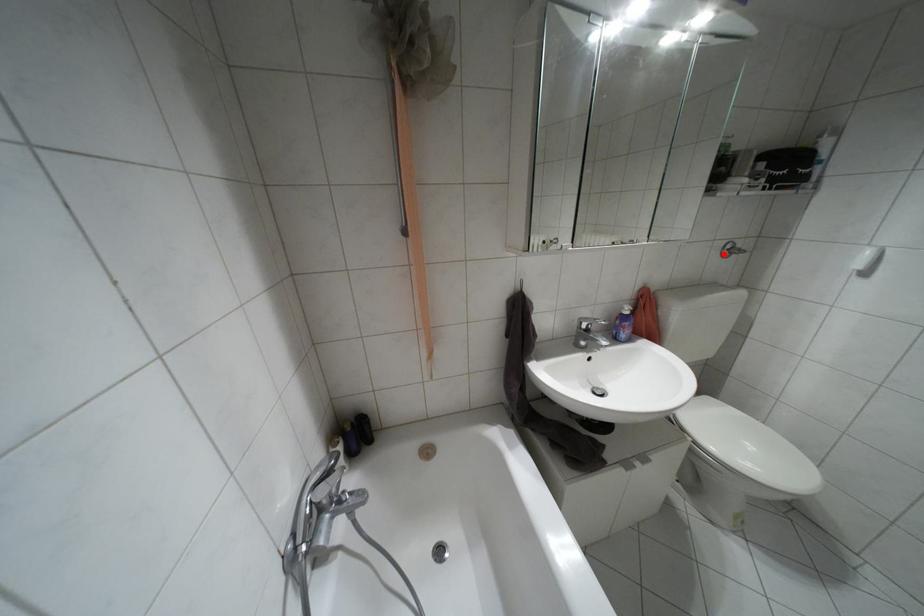
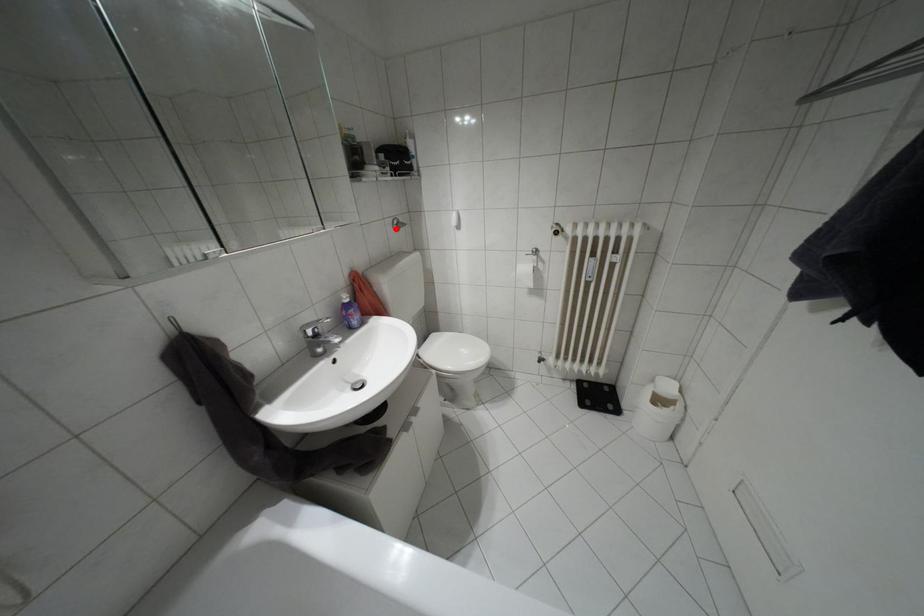
I am providing you with two images of the same scene from different viewpoints. A red point is marked on the first image and another point is marked on the second image. Is the marked point in image1 the same physical position as the marked point in image2?

Yes